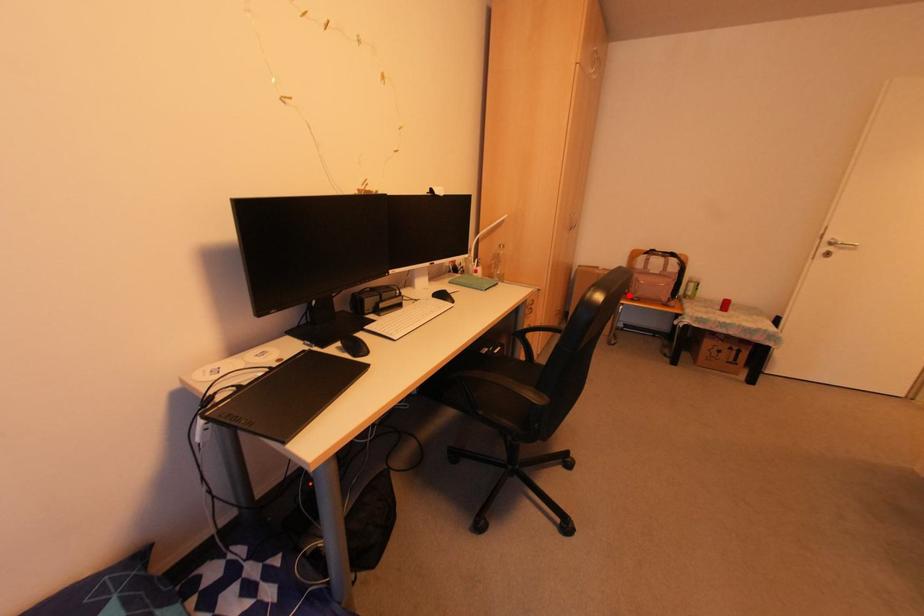
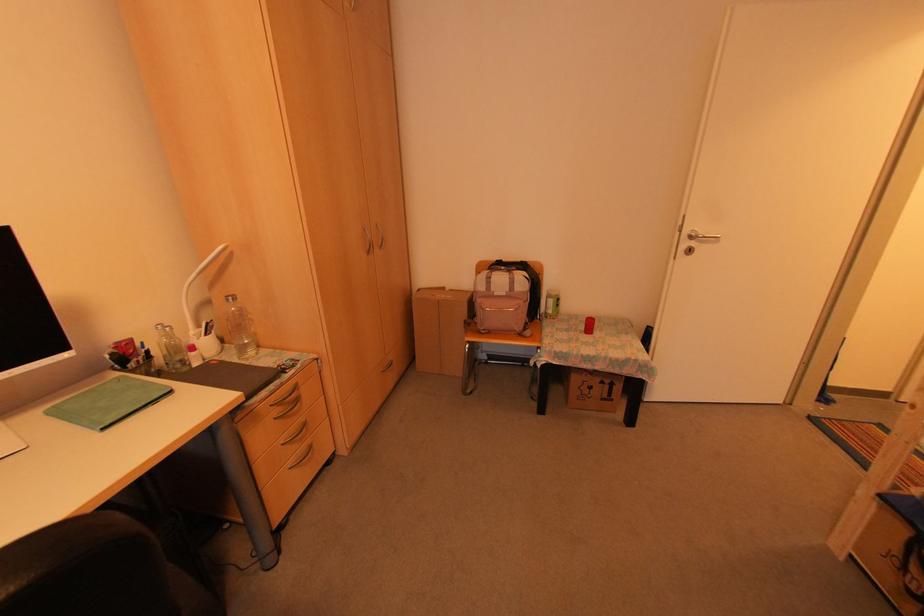
Locate, in the second image, the point that corresponds to the highlighted location in the first image.

(477, 326)